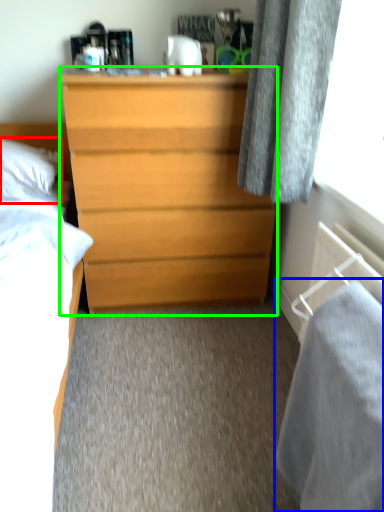
Question: Based on their relative distances, which object is nearer to pillow (highlighted by a red box)? Choose from sheet (highlighted by a blue box) and chest of drawers (highlighted by a green box).

Choices:
 (A) sheet
 (B) chest of drawers

Answer: (B)